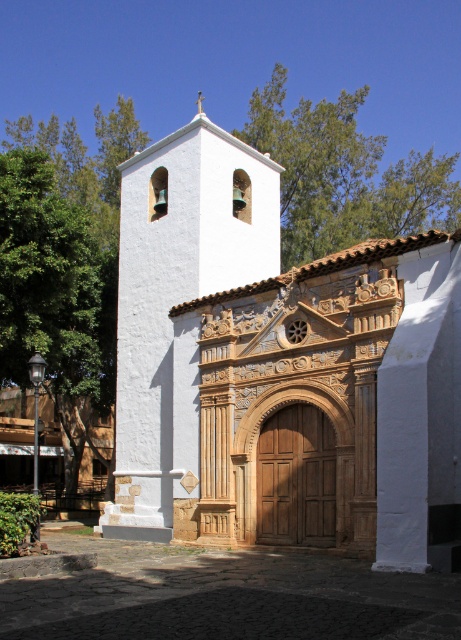
Question: Among these objects, which one is nearest to the camera?

Choices:
 (A) white stucco bell tower at upper left
 (B) white stucco church at center

Answer: (B)

Question: Among these objects, which one is nearest to the camera?

Choices:
 (A) white stucco church at center
 (B) white stucco bell tower at upper left

Answer: (A)

Question: Is white stucco church at center thinner than white stucco bell tower at upper left?

Choices:
 (A) no
 (B) yes

Answer: (A)

Question: Where is white stucco church at center located in relation to white stucco bell tower at upper left in the image?

Choices:
 (A) below
 (B) above

Answer: (A)

Question: Among these points, which one is nearest to the camera?

Choices:
 (A) (254, 524)
 (B) (169, 371)

Answer: (A)

Question: Does white stucco church at center appear over white stucco bell tower at upper left?

Choices:
 (A) no
 (B) yes

Answer: (A)